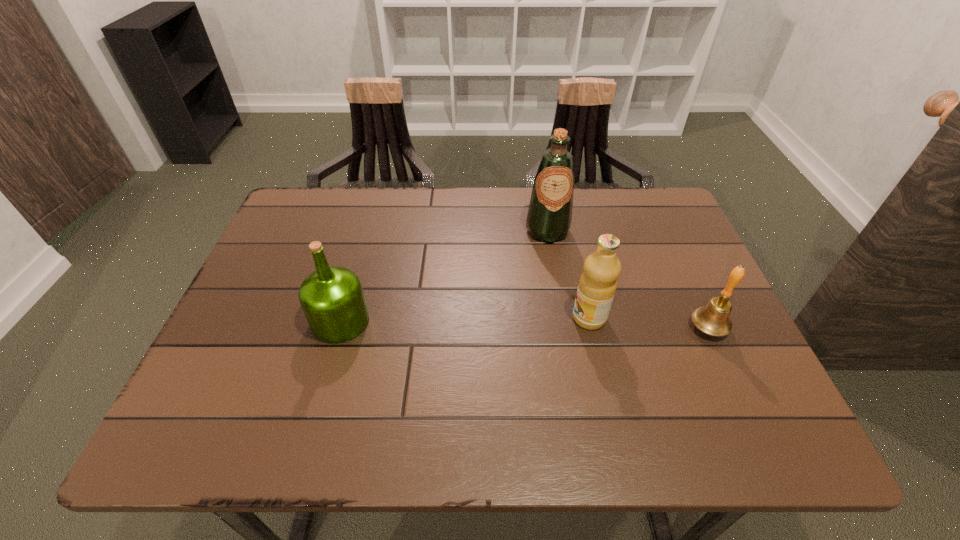
Locate which olive oil is the second closest to the bell. Please provide its 2D coordinates. Your answer should be formatted as a tuple, i.e. [(x, y)], where the tuple contains the x and y coordinates of a point satisfying the conditions above.

[(549, 217)]

Find the location of a particular element. olive oil that stands as the second closest to the leftmost object is located at coordinates (597, 285).

At what (x,y) coordinates should I click in order to perform the action: click on vacant point that satisfies the following two spatial constraints: 1. on the front-facing side of the farthest object; 2. on the right side of the shortest object. Please return your answer as a coordinate pair (x, y). This screenshot has width=960, height=540. Looking at the image, I should click on (564, 328).

Image resolution: width=960 pixels, height=540 pixels. I want to click on vacant space that satisfies the following two spatial constraints: 1. on the front-facing side of the shortest object; 2. on the right side of the tallest object, so click(564, 328).